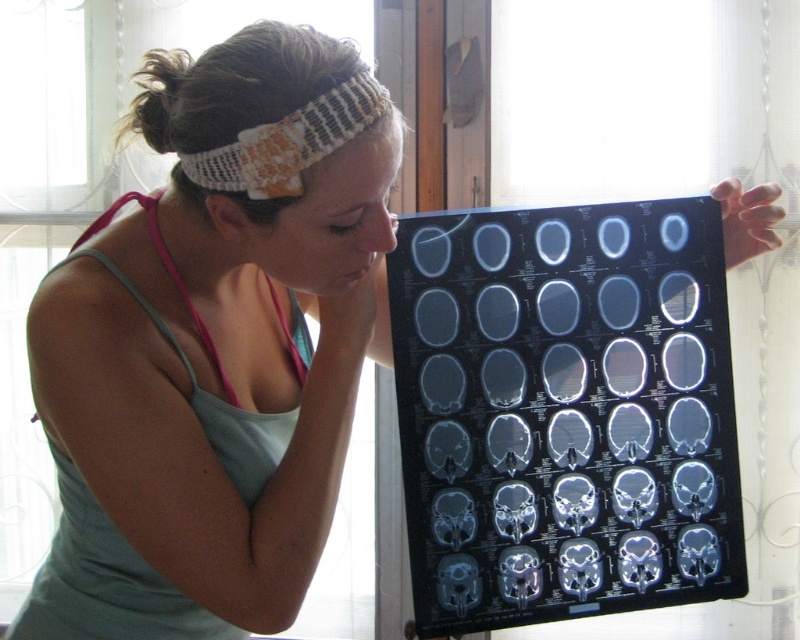
Does white knitted headscarf at upper center appear on the right side of white knitted headband at upper center?

In fact, white knitted headscarf at upper center is to the left of white knitted headband at upper center.

Is point (358, 122) behind point (376, 177)?

No.

What do you see at coordinates (289, 141) in the screenshot? I see `white knitted headscarf at upper center` at bounding box center [289, 141].

Find the location of `white knitted headscarf at upper center`. white knitted headscarf at upper center is located at coordinates (289, 141).